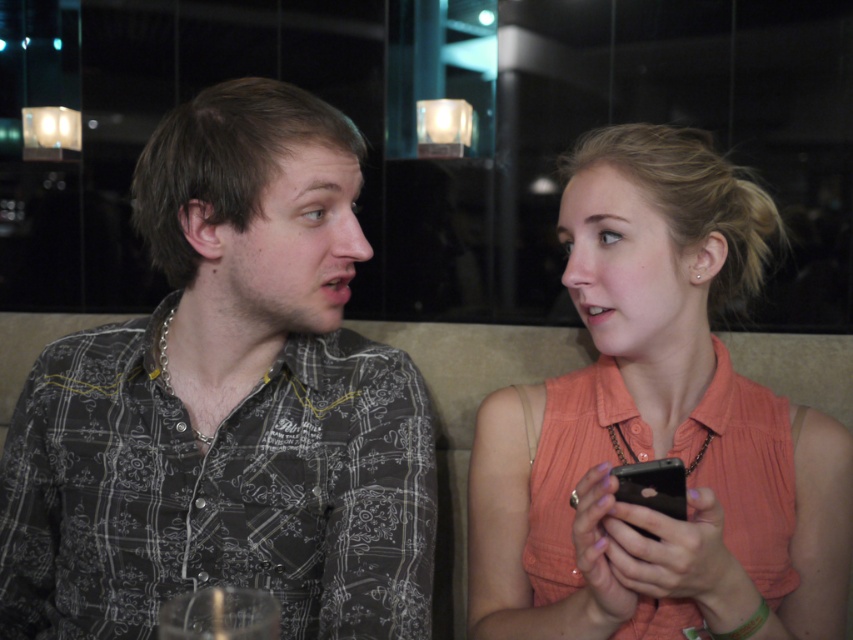
Is point (202, 573) positioned after point (635, 486)?

Yes, point (202, 573) is behind point (635, 486).

Identify the location of dark gray printed shirt at left. (227, 404).

Does point (109, 616) lie in front of point (844, 492)?

No, it is behind (844, 492).

Does point (281, 144) come behind point (718, 632)?

Yes.

Identify the location of dark gray printed shirt at left. This screenshot has width=853, height=640. (227, 404).

Image resolution: width=853 pixels, height=640 pixels. Identify the location of dark gray printed shirt at left. (227, 404).

Does matte peach sleeveless top at right appear on the right side of black matte smartphone at lower right?

Correct, you'll find matte peach sleeveless top at right to the right of black matte smartphone at lower right.

Between point (677, 339) and point (618, 467), which one is positioned behind?

Point (677, 339)

Locate an element on the screen. The height and width of the screenshot is (640, 853). matte peach sleeveless top at right is located at coordinates coord(657,428).